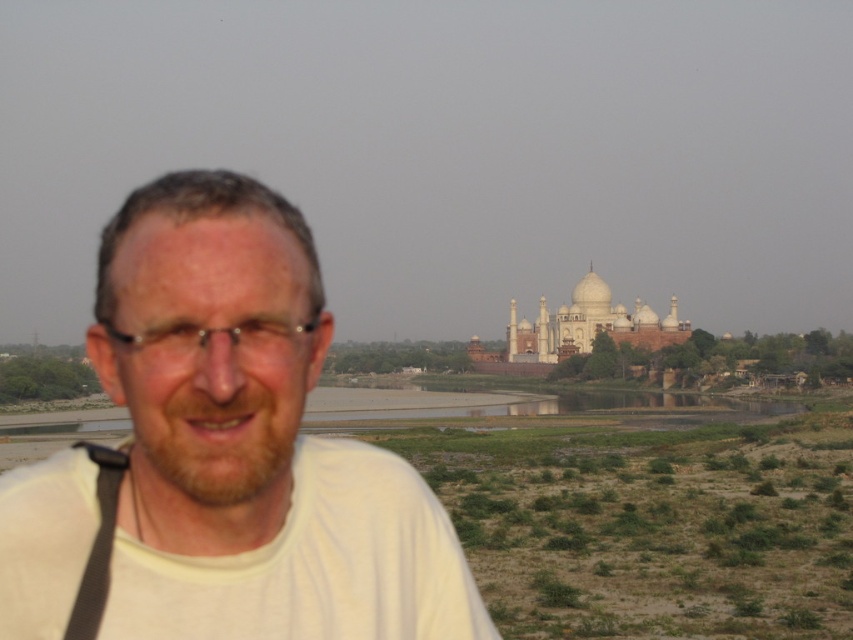
Between white matte shirt at left and black fabric strap at lower left, which one is positioned lower?

black fabric strap at lower left is lower down.

Measure the distance from white matte shirt at left to black fabric strap at lower left.

They are 7.91 meters apart.

Is point (265, 384) positioned before point (96, 611)?

No.

Where is `white matte shirt at left`? The image size is (853, 640). white matte shirt at left is located at coordinates (248, 440).

What do you see at coordinates (248, 440) in the screenshot? I see `white matte shirt at left` at bounding box center [248, 440].

Is white matte shirt at left further to camera compared to white marble palace at center?

No, it is in front of white marble palace at center.

Which is in front, point (117, 621) or point (509, 323)?

Point (117, 621)

Where is `white matte shirt at left`? The height and width of the screenshot is (640, 853). white matte shirt at left is located at coordinates (248, 440).

Who is shorter, white marble palace at center or black fabric strap at lower left?

black fabric strap at lower left

Is white marble palace at center taller than black fabric strap at lower left?

Yes.

Who is more forward, (x=531, y=333) or (x=99, y=516)?

Point (x=99, y=516) is in front.

The height and width of the screenshot is (640, 853). What are the coordinates of `white marble palace at center` in the screenshot? It's located at (589, 324).